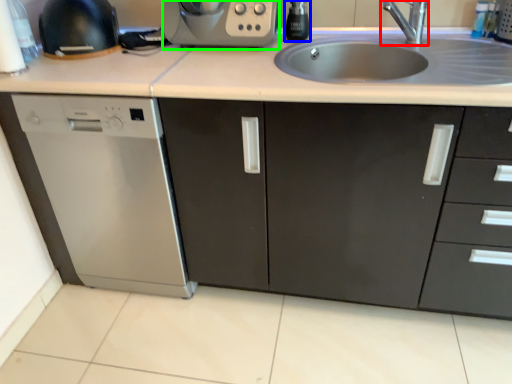
Question: Which object is positioned farthest from tap (highlighted by a red box)? Select from appliance (highlighted by a blue box) and kitchen appliance (highlighted by a green box).

Choices:
 (A) appliance
 (B) kitchen appliance

Answer: (B)